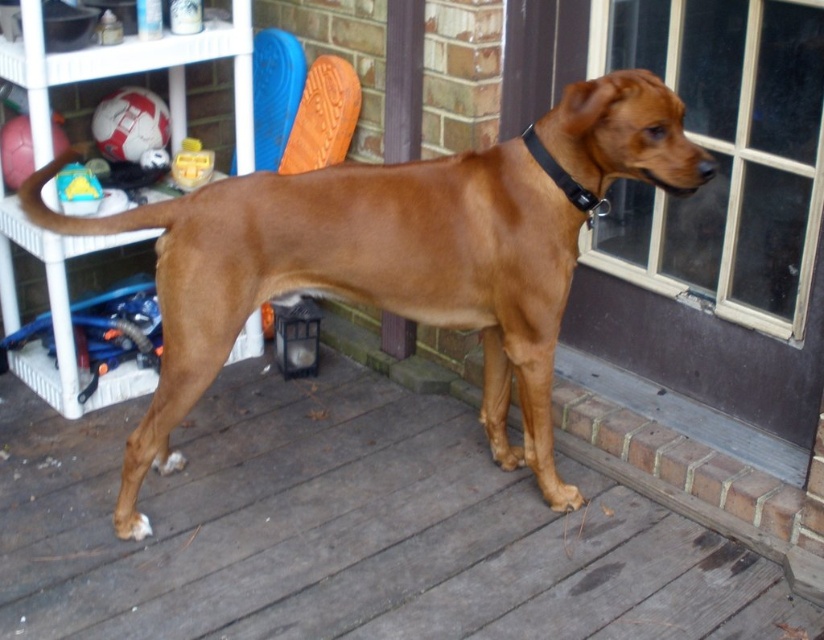
You are a photographer trying to capture the perfect shot of the two points in the scene. Which point, point (150, 545) or point (593, 173), is closer to your camera lens?

Point (150, 545) is further to the camera than point (593, 173), so the point closer to the camera lens is point (150, 545).

You are a dog trainer observing the brown shiny dog at center and its black leather collar at upper center. If the dog moves forward by 20 centimeters, will the collar still be visible on its neck?

The distance between the brown shiny dog at center and the black leather collar at upper center is 39.42 centimeters. If the dog moves forward by 20 centimeters, the collar would still be visible on its neck since the collar is part of the dog and moves with it.